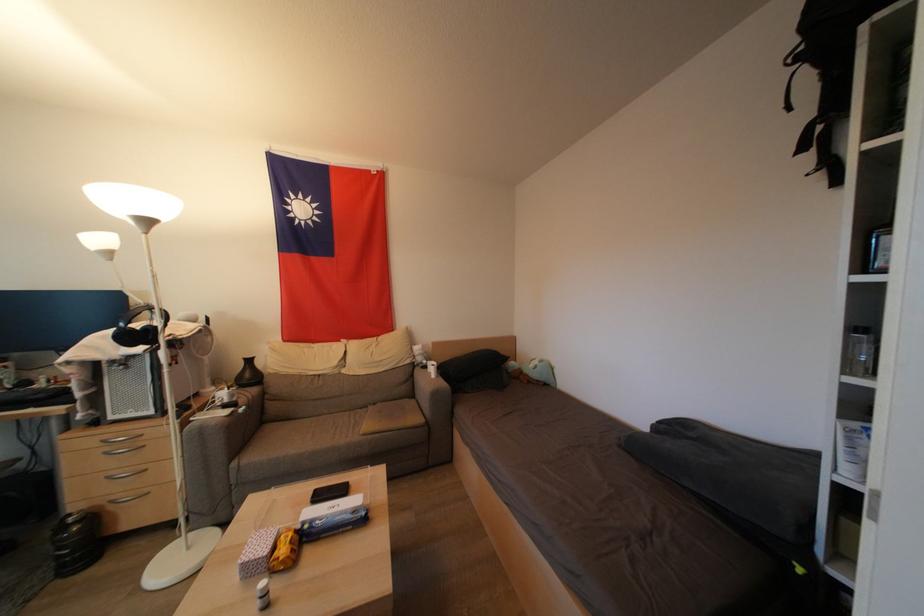
Identify the location of sofa armrest. (427, 379).